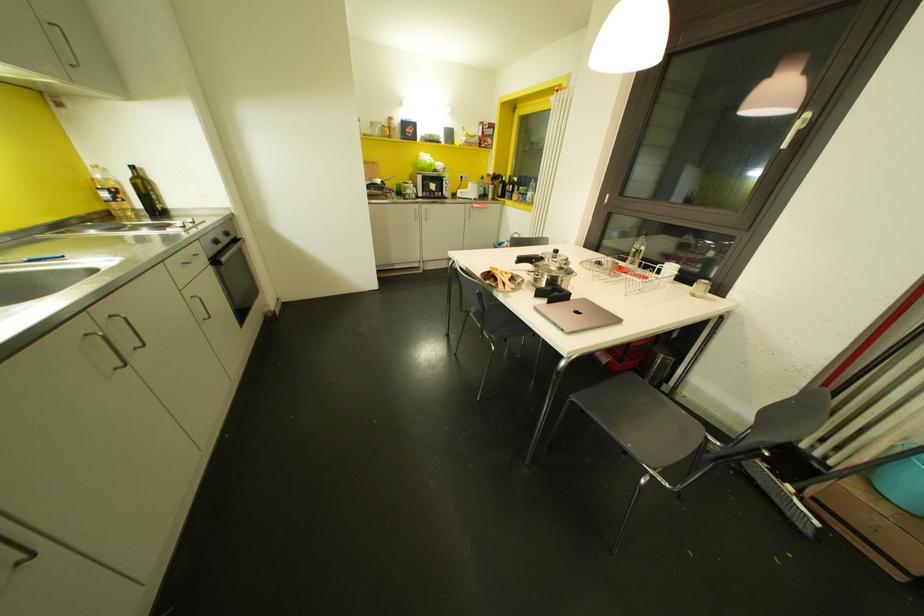
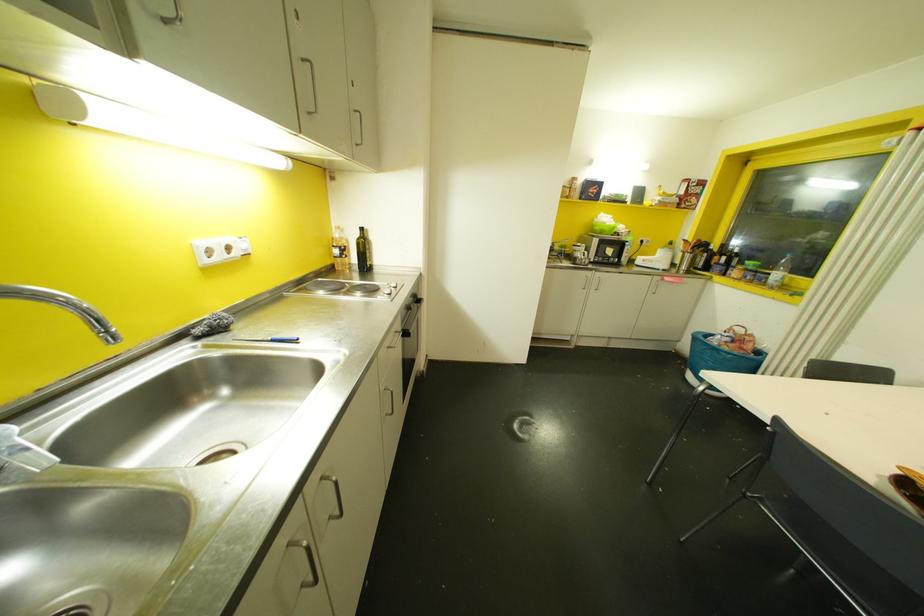
Find the pixel in the second image that matches point 529,193 in the first image.

(776, 274)